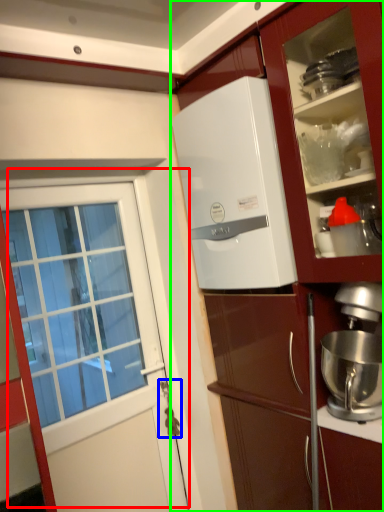
Question: Estimate the real-world distances between objects in this image. Which object is closer to door (highlighted by a red box), door handle (highlighted by a blue box) or cabinetry (highlighted by a green box)?

Choices:
 (A) door handle
 (B) cabinetry

Answer: (A)